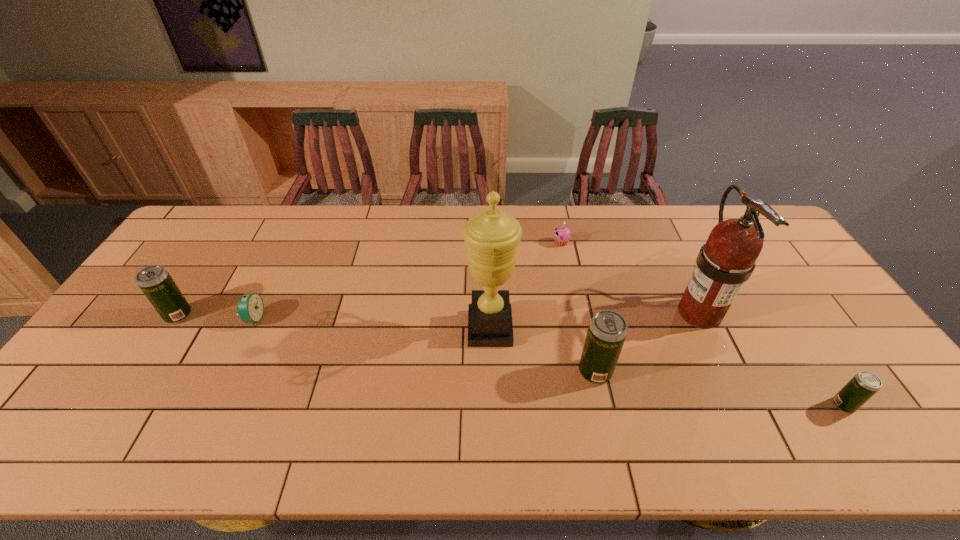
What are the coordinates of `the fourth shortest object` in the screenshot? It's located at (156, 283).

What are the coordinates of `the leftmost object` in the screenshot? It's located at (156, 283).

Find the location of a particular element. the second beer can from left to right is located at coordinates (607, 331).

Identify the location of the shortest beer can. (865, 384).

Identify the location of the nearest beer can. This screenshot has height=540, width=960. (865, 384).

In order to click on alarm clock in this screenshot , I will do `click(250, 307)`.

The width and height of the screenshot is (960, 540). Find the location of `the sixth object from left to right`. the sixth object from left to right is located at coordinates (727, 260).

You are a GUI agent. You are given a task and a screenshot of the screen. Output one action in this format:
    pyautogui.click(x=<x>, y=<y>)
    Task: Click on the farthest object
    Image resolution: width=960 pixels, height=540 pixels.
    Given the screenshot: What is the action you would take?
    pyautogui.click(x=562, y=234)

At what (x,y) coordinates should I click in order to perform the action: click on the third object from left to right. Please return your answer as a coordinate pair (x, y). The image size is (960, 540). Looking at the image, I should click on (492, 237).

This screenshot has height=540, width=960. I want to click on vacant space positioned 0.400m on the right of the farthest beer can, so click(x=331, y=315).